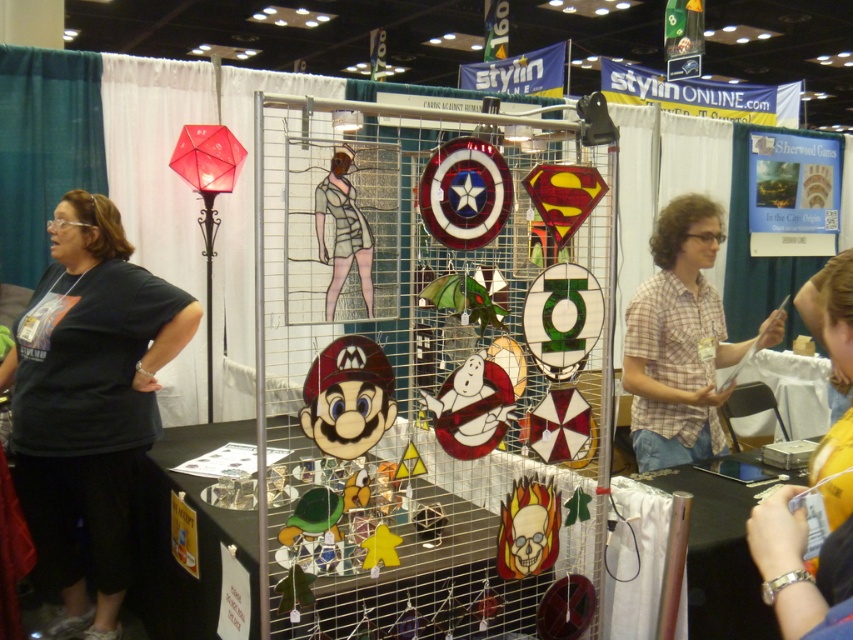
You are a photographer at the convention and need to take a group photo of the black fabric shirt at left and plaid shirt at center. The camera frame can only accommodate one shirt width. Which shirt should you prioritize to ensure it fits within the frame?

The black fabric shirt at left might be wider than plaid shirt at center, so prioritizing the black fabric shirt at left would ensure the frame can accommodate its width.

You are a convention attendee standing at the entrance of the booth. You see the point marked at coordinates (88,403). What object is located at that point?

The point at coordinates (88,403) marks the location of the black fabric shirt at left.